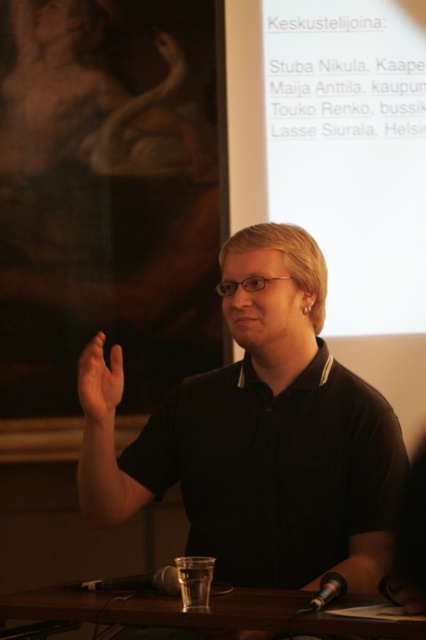
You are an event attendee and you want to see the projection screen text clearly. The black matte shirt at center and transparent glass at lower center are in your line of sight. Which object is blocking your view of the screen?

The transparent glass at lower center is behind the black matte shirt at center, so the black matte shirt at center is blocking your view of the projection screen text.

Based on the scene described, where exactly is the black matte shirt at center located in terms of coordinates?

The black matte shirt at center is located at point coordinates of (267, 436).

You are a stagehand standing 2 meters away from the podium. You need to adjust the lighting to focus on the point at coordinate point [111,616]. Can you reach the point from your current position?

The distance of point [111,616] from viewer is 1.53 meters. Since you are standing 2 meters away from the podium, you can reach the point as it is closer than your current distance.